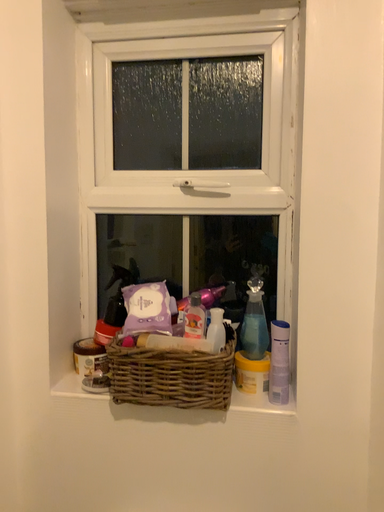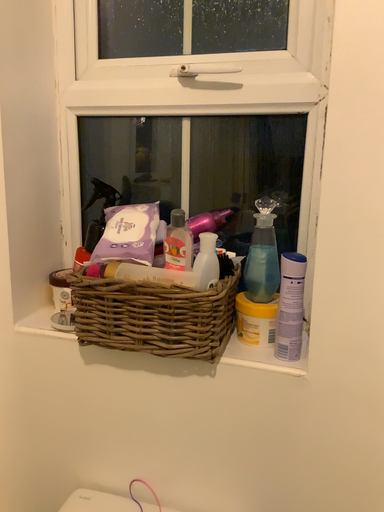
Question: Which way did the camera rotate in the video?

Choices:
 (A) rotated upward
 (B) rotated downward

Answer: (B)